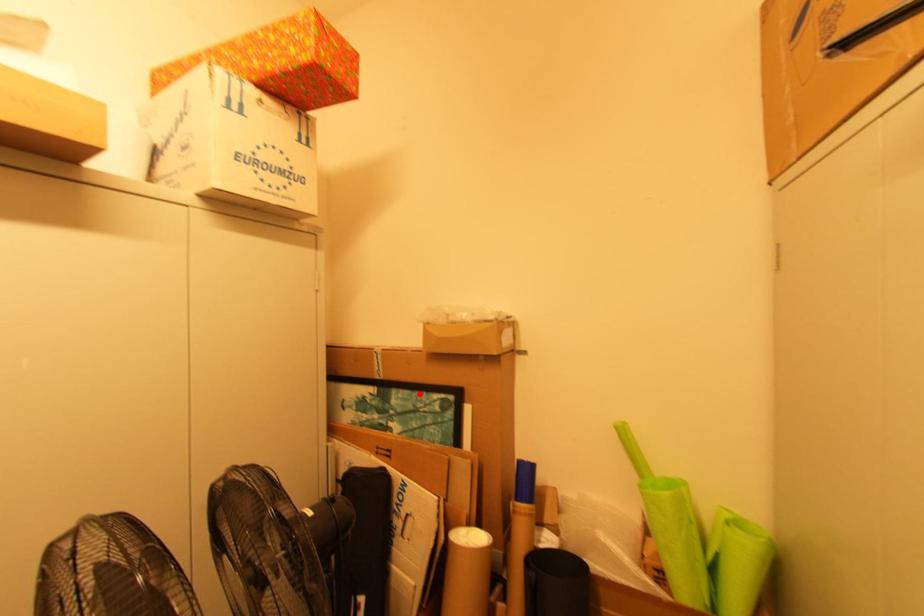
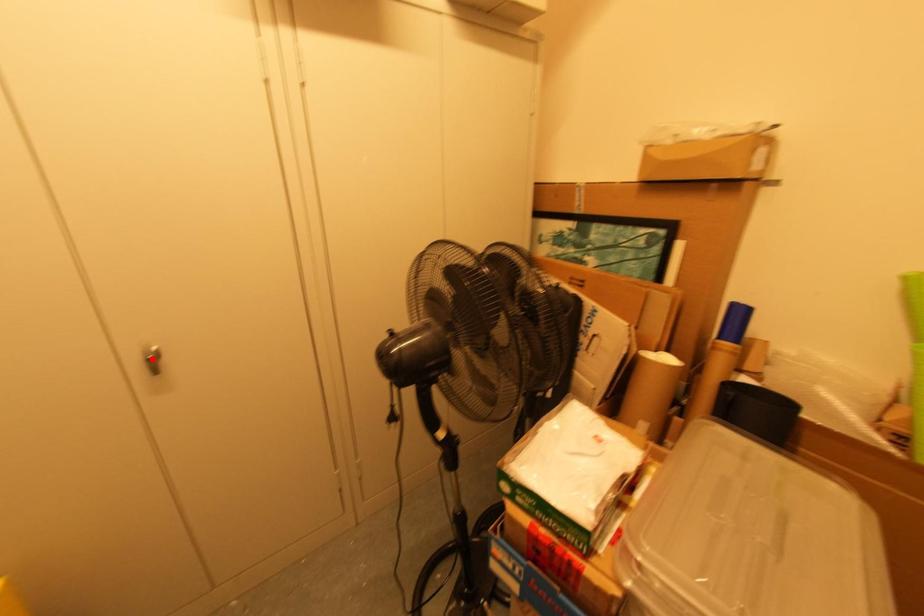
I am providing you with two images of the same scene from different viewpoints. A red point is marked on the first image and another point is marked on the second image. Is the marked point in image1 the same physical position as the marked point in image2?

No